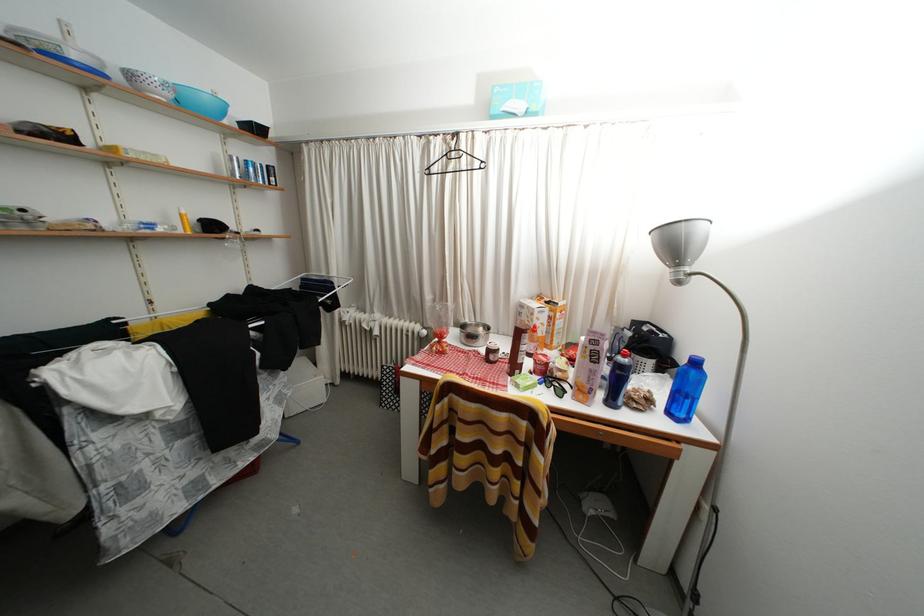
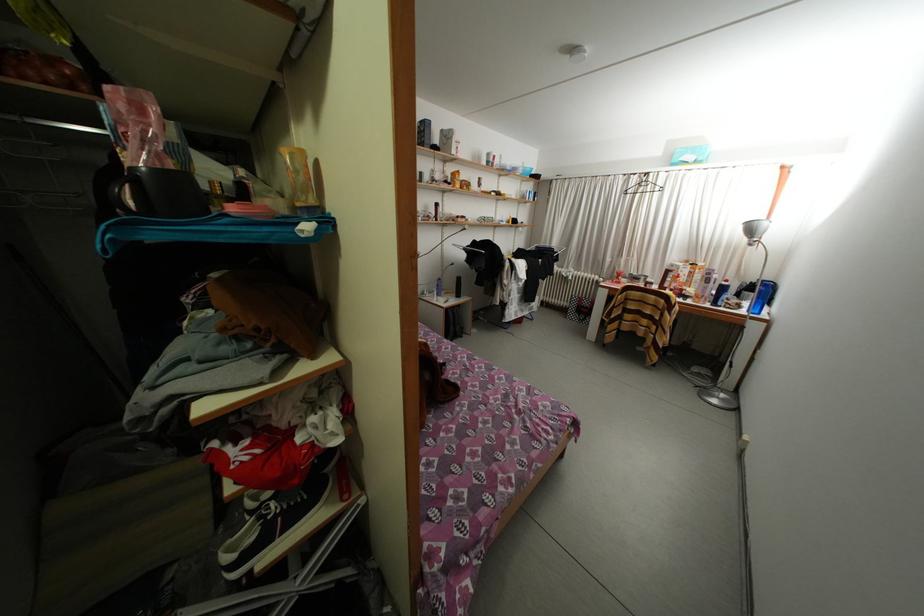
Where in the second image is the point corresponding to (658,406) from the first image?

(747, 310)